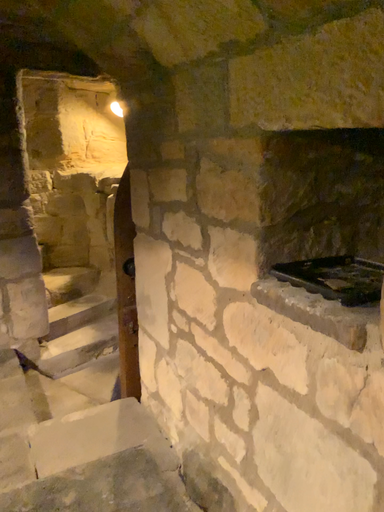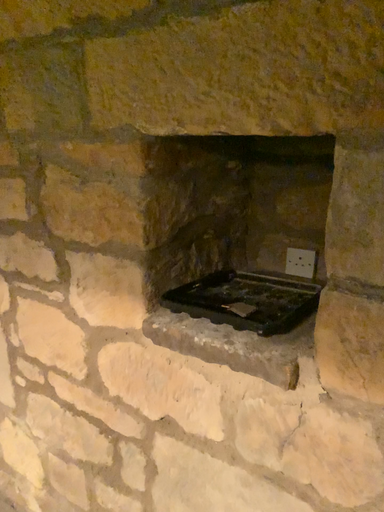
Question: Which way did the camera rotate in the video?

Choices:
 (A) rotated right
 (B) rotated left

Answer: (A)